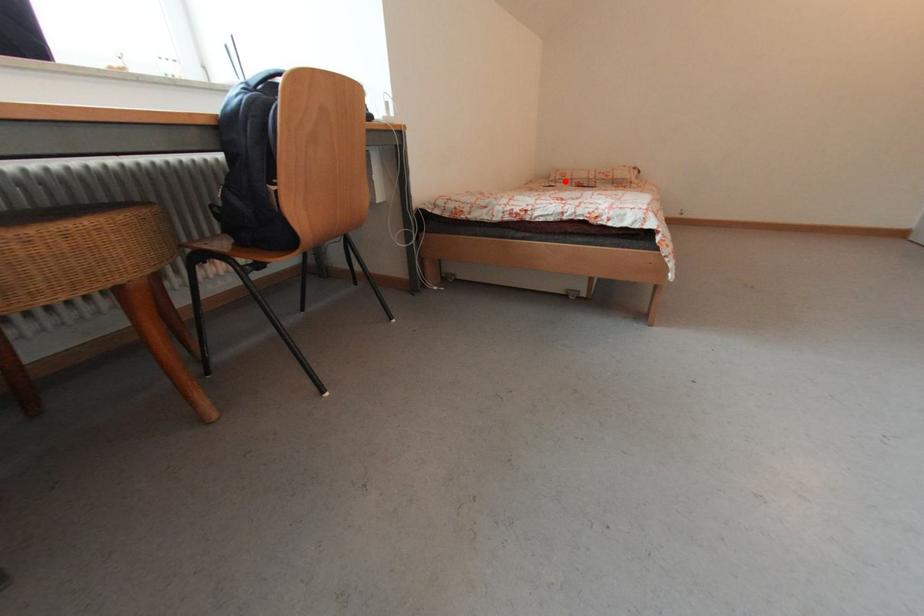
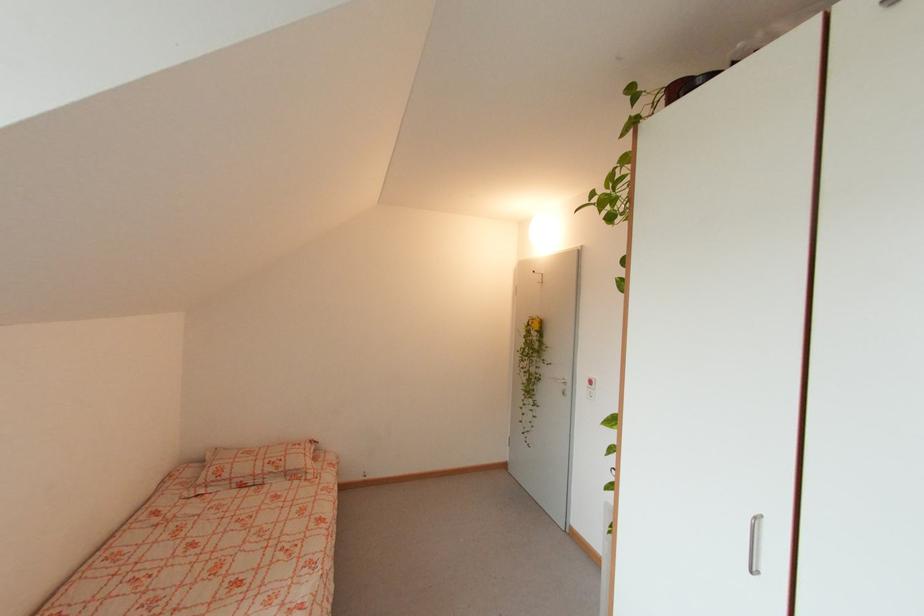
The point at the highlighted location is marked in the first image. Where is the corresponding point in the second image?

(219, 484)